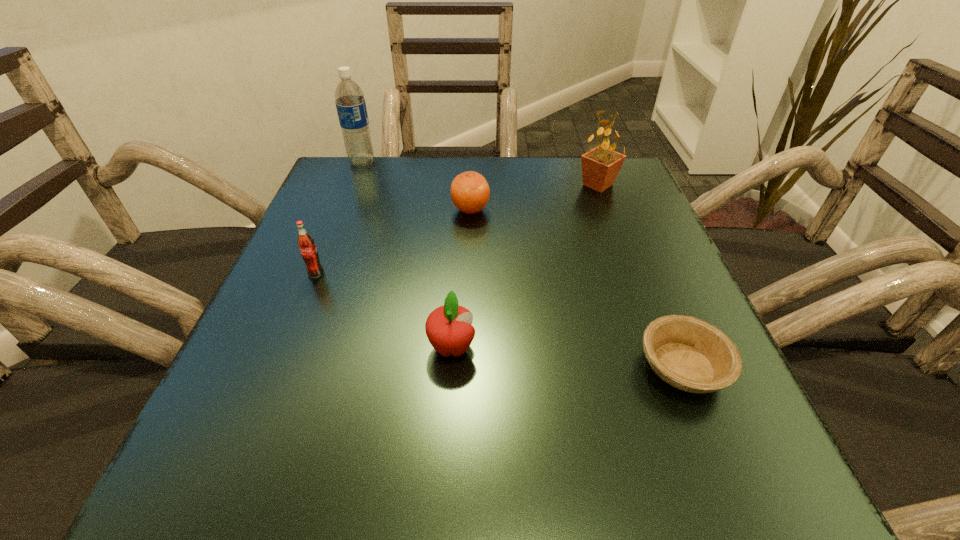
Find the location of a particular element. This screenshot has height=540, width=960. vacant area at the far left corner of the desktop is located at coordinates (395, 167).

In the image, there is a desktop. At what (x,y) coordinates should I click in order to perform the action: click on vacant space at the near left corner. Please return your answer as a coordinate pair (x, y). This screenshot has width=960, height=540. Looking at the image, I should click on (260, 460).

Where is `free space at the far right corner of the desktop`? free space at the far right corner of the desktop is located at coordinates (632, 179).

Locate an element on the screen. Image resolution: width=960 pixels, height=540 pixels. empty space between the water bottle and the fourth nearest object is located at coordinates (417, 186).

Where is `free spot between the farthest object and the bowl`? Image resolution: width=960 pixels, height=540 pixels. free spot between the farthest object and the bowl is located at coordinates (522, 265).

This screenshot has height=540, width=960. Identify the location of free area in between the farthest object and the bowl. (522, 265).

At what (x,y) coordinates should I click in order to perform the action: click on free spot between the fourth shortest object and the apple. Please return your answer as a coordinate pair (x, y). Looking at the image, I should click on (384, 310).

Where is `vacant space that is in between the orange and the shortest object`? This screenshot has height=540, width=960. vacant space that is in between the orange and the shortest object is located at coordinates point(576,288).

The image size is (960, 540). I want to click on free space between the bowl and the third tallest object, so click(499, 321).

Find the location of a particular element. This screenshot has width=960, height=540. vacant area between the water bottle and the apple is located at coordinates (407, 255).